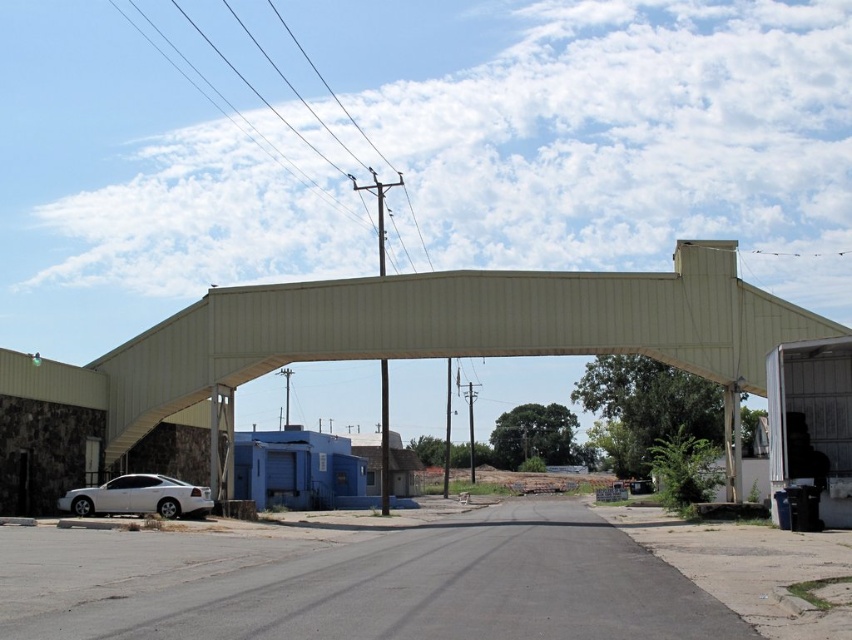
You are driving a truck that is 3 meters tall. You need to pass under the metallic roof at center. Can you safely drive under it without hitting the roof, considering the white glossy sedan at lower left is parked nearby?

The metallic roof at center is closer to the viewer than the white glossy sedan at lower left, which means the roof is lower in height. Since your truck is 3 meters tall, you might hit the roof if it is lower than 3 meters. However, the exact height isn